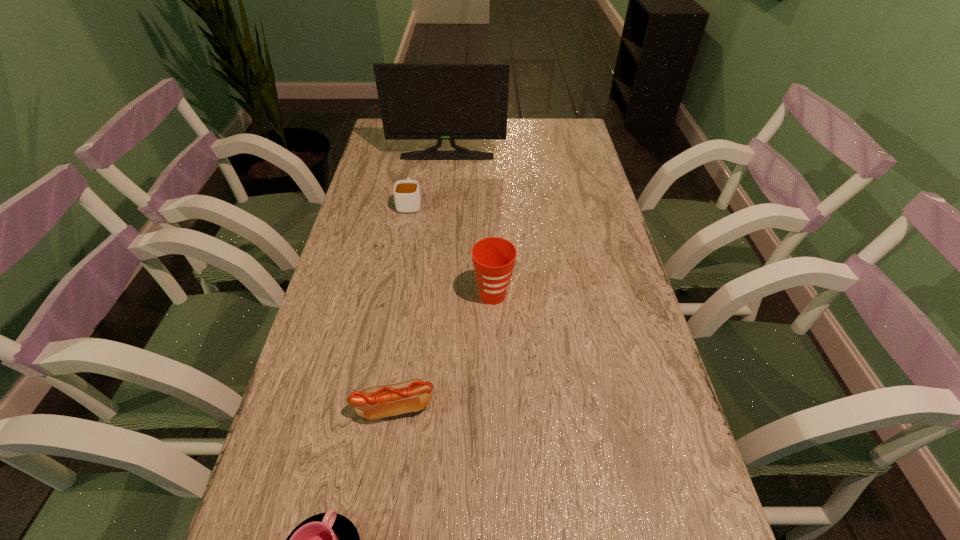
Find the location of a particular element. free space between the farthest object and the fourth farthest object is located at coordinates (420, 281).

Where is `free spot between the tallest object and the fourth shortest object`? This screenshot has height=540, width=960. free spot between the tallest object and the fourth shortest object is located at coordinates (469, 226).

The image size is (960, 540). In order to click on free space that is in between the fourth farthest object and the rightmost cup in this screenshot , I will do `click(444, 351)`.

This screenshot has width=960, height=540. I want to click on free spot between the tallest cup and the sausage, so click(x=444, y=351).

Image resolution: width=960 pixels, height=540 pixels. I want to click on vacant region between the third farthest object and the sausage, so click(x=444, y=351).

Where is `vacant point located between the rightmost cup and the sausage`? vacant point located between the rightmost cup and the sausage is located at coordinates (444, 351).

Where is `object that stands as the fourth closest to the tallest cup`? The image size is (960, 540). object that stands as the fourth closest to the tallest cup is located at coordinates (418, 101).

Where is `object that is the third closest to the second nearest object`? object that is the third closest to the second nearest object is located at coordinates (407, 198).

Select which cup is the closest to the sausage. Please provide its 2D coordinates. Your answer should be formatted as a tuple, i.e. [(x, y)], where the tuple contains the x and y coordinates of a point satisfying the conditions above.

[(329, 539)]

Choose which cup is the nearest neighbor to the farthest object. Please provide its 2D coordinates. Your answer should be formatted as a tuple, i.e. [(x, y)], where the tuple contains the x and y coordinates of a point satisfying the conditions above.

[(407, 198)]